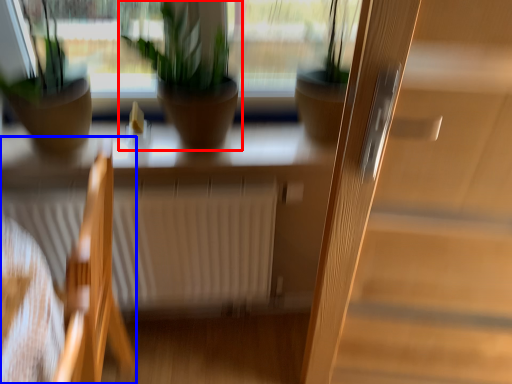
Question: Among these objects, which one is nearest to the camera, houseplant (highlighted by a red box) or chair (highlighted by a blue box)?

Choices:
 (A) houseplant
 (B) chair

Answer: (B)